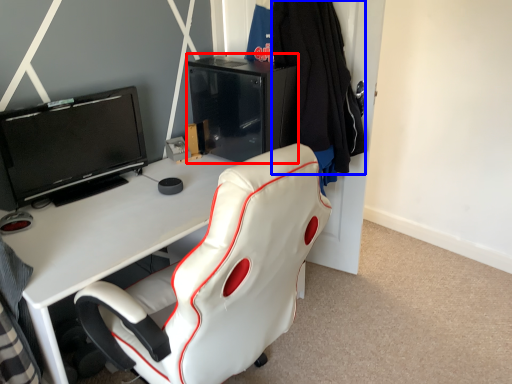
Question: Among these objects, which one is farthest to the camera, file cabinet (highlighted by a red box) or clothing (highlighted by a blue box)?

Choices:
 (A) file cabinet
 (B) clothing

Answer: (A)